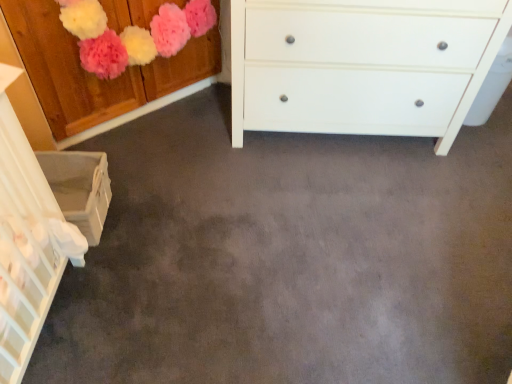
You are a GUI agent. You are given a task and a screenshot of the screen. Output one action in this format:
    pyautogui.click(x=<x>, y=<y>)
    Task: Click on the vacant space in front of white matte chest of drawers at center
    The image size is (512, 384).
    Given the screenshot: What is the action you would take?
    pyautogui.click(x=312, y=238)